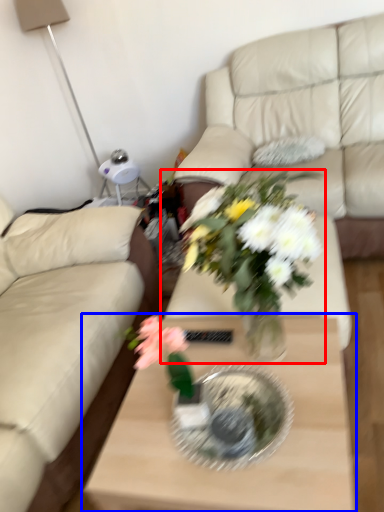
Question: Which point is closer to the camera, houseplant (highlighted by a red box) or coffee table (highlighted by a blue box)?

Choices:
 (A) houseplant
 (B) coffee table

Answer: (A)